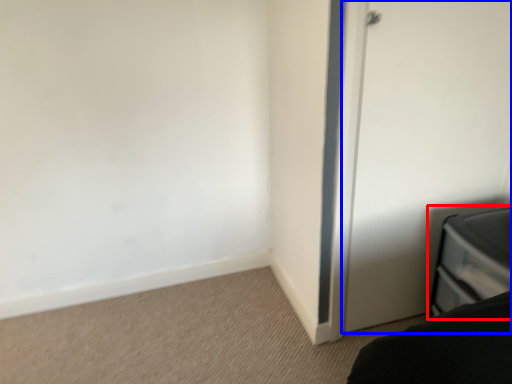
Question: Among these objects, which one is nearest to the camera, furniture (highlighted by a red box) or door (highlighted by a blue box)?

Choices:
 (A) furniture
 (B) door

Answer: (A)